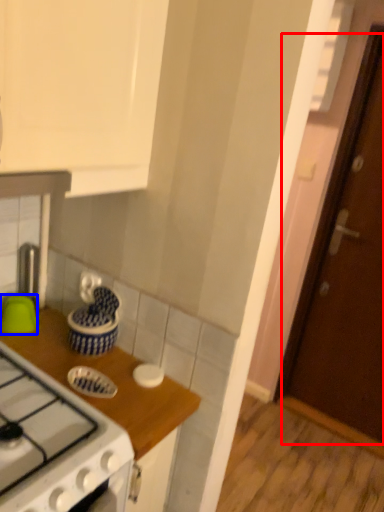
Question: Which object is further to the camera taking this photo, door (highlighted by a red box) or kitchen appliance (highlighted by a blue box)?

Choices:
 (A) door
 (B) kitchen appliance

Answer: (A)